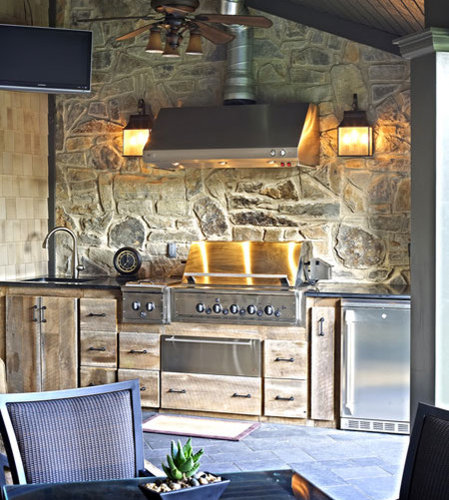
Identify the location of table. This screenshot has width=449, height=500. (278, 479).